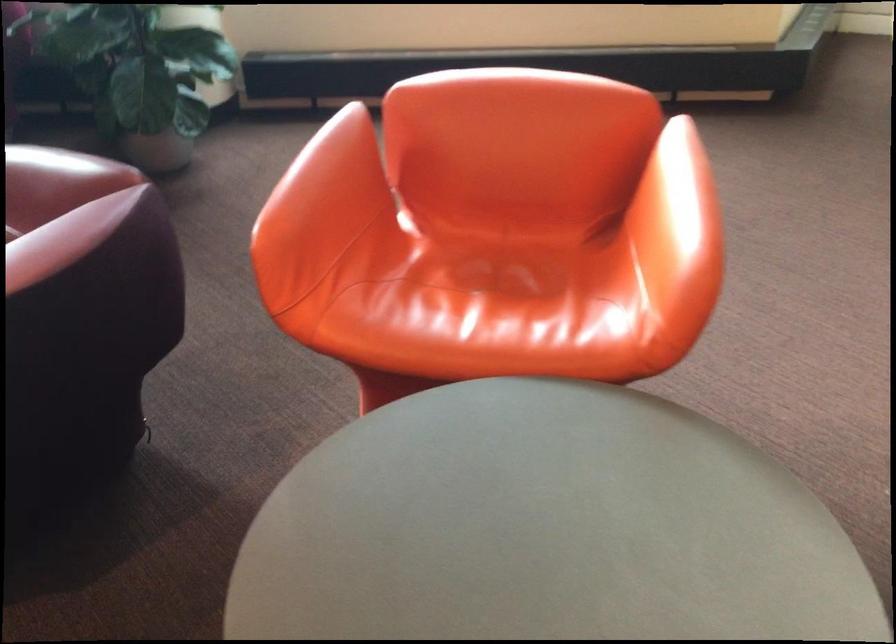
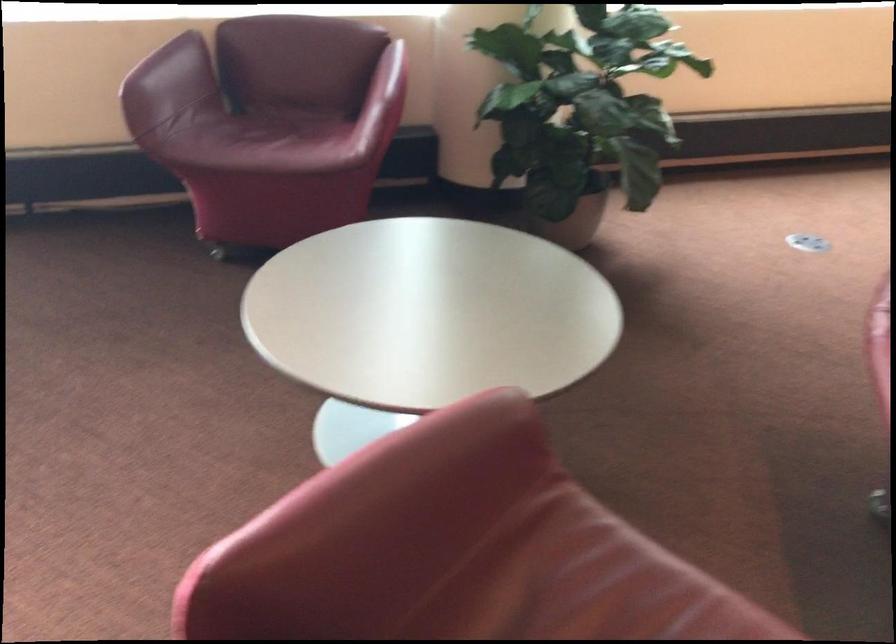
Find the pixel in the second image that matches pixel 126 149 in the first image.

(573, 223)